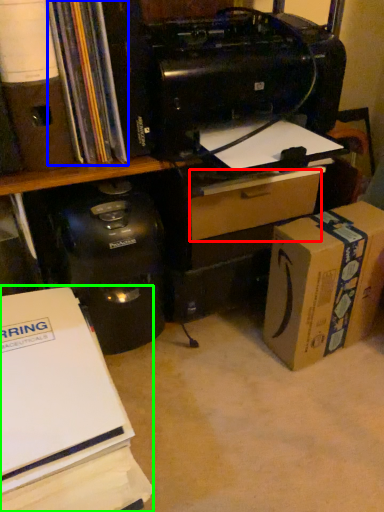
Question: Which object is positioned closest to drawer (highlighted by a red box)? Select from book (highlighted by a blue box) and office supplies (highlighted by a green box).

Choices:
 (A) book
 (B) office supplies

Answer: (A)